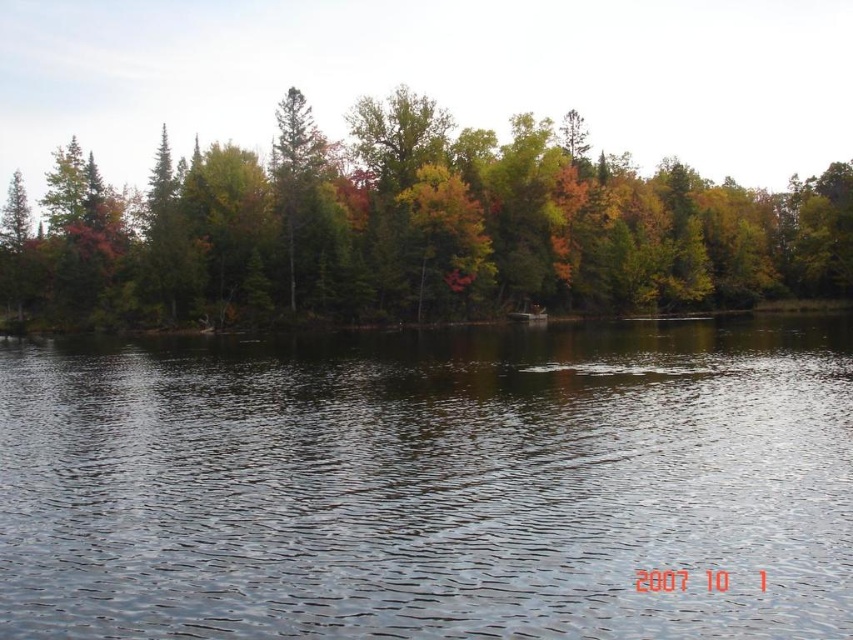
You are standing at the lakeside and want to walk towards the two points marked in the image. Which point, point (15, 428) or point (62, 182), is closer to you?

Point (15, 428) is closer to you because it is in front of point (62, 182).